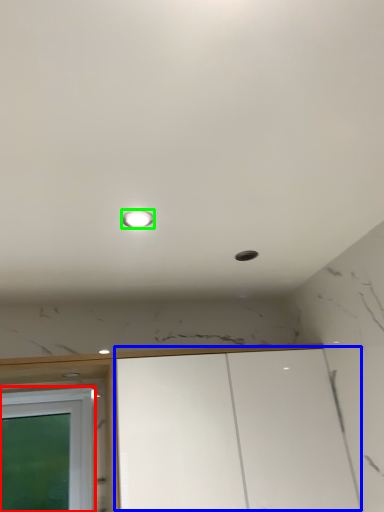
Question: Based on their relative distances, which object is nearer to window (highlighted by a red box)? Choose from cabinetry (highlighted by a blue box) and light (highlighted by a green box).

Choices:
 (A) cabinetry
 (B) light

Answer: (A)